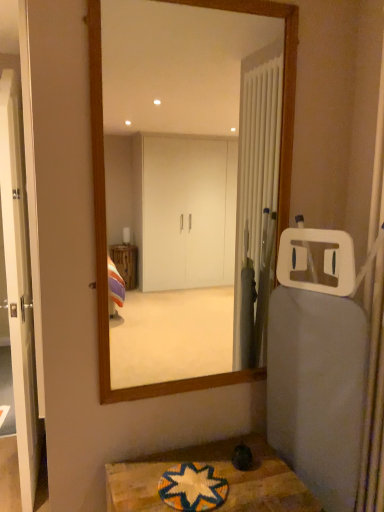
This screenshot has height=512, width=384. Identify the location of free area behind multicolored woven mat at lower center. (196, 451).